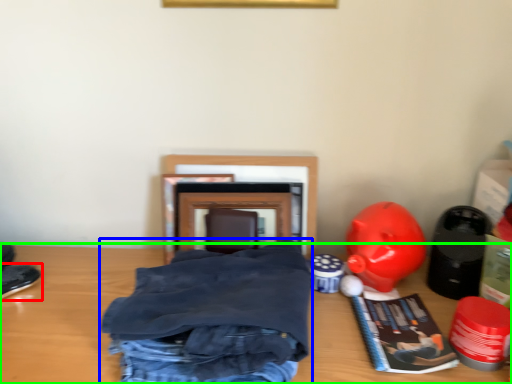
Question: Considering the real-world distances, which object is closest to footwear (highlighted by a red box)? clothing (highlighted by a blue box) or table (highlighted by a green box).

Choices:
 (A) clothing
 (B) table

Answer: (B)